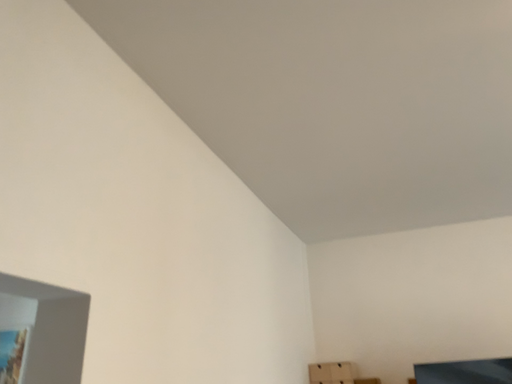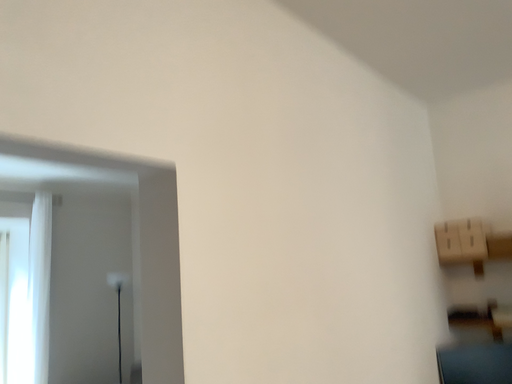
Question: Which way did the camera rotate in the video?

Choices:
 (A) rotated left
 (B) rotated right

Answer: (A)